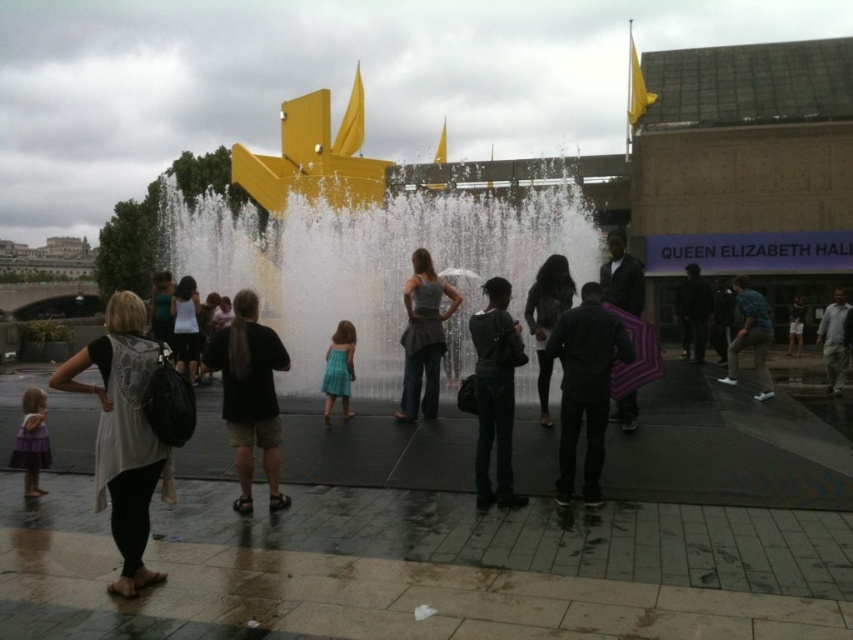
Describe the element at coordinates (585, 387) in the screenshot. I see `black matte jacket at center` at that location.

Is point (578, 333) more distant than point (498, 294)?

No, it is not.

Locate an element on the screen. black matte jacket at center is located at coordinates (585, 387).

Between point (271, 458) and point (798, 330), which one is positioned behind?

Positioned behind is point (798, 330).

Does black cotton shirt at center appear under matte black jacket at center?

Indeed, black cotton shirt at center is positioned under matte black jacket at center.

Between point (223, 349) and point (787, 337), which one is positioned behind?

Positioned behind is point (787, 337).

Image resolution: width=853 pixels, height=640 pixels. I want to click on black cotton shirt at center, so click(x=248, y=394).

Who is taller, blue plaid shirt at center or teal satin dress at center?

blue plaid shirt at center is taller.

Does blue plaid shirt at center have a greater height compared to teal satin dress at center?

Correct, blue plaid shirt at center is much taller as teal satin dress at center.

This screenshot has width=853, height=640. What do you see at coordinates (750, 336) in the screenshot? I see `blue plaid shirt at center` at bounding box center [750, 336].

Find the location of a particular element. The width and height of the screenshot is (853, 640). blue plaid shirt at center is located at coordinates (750, 336).